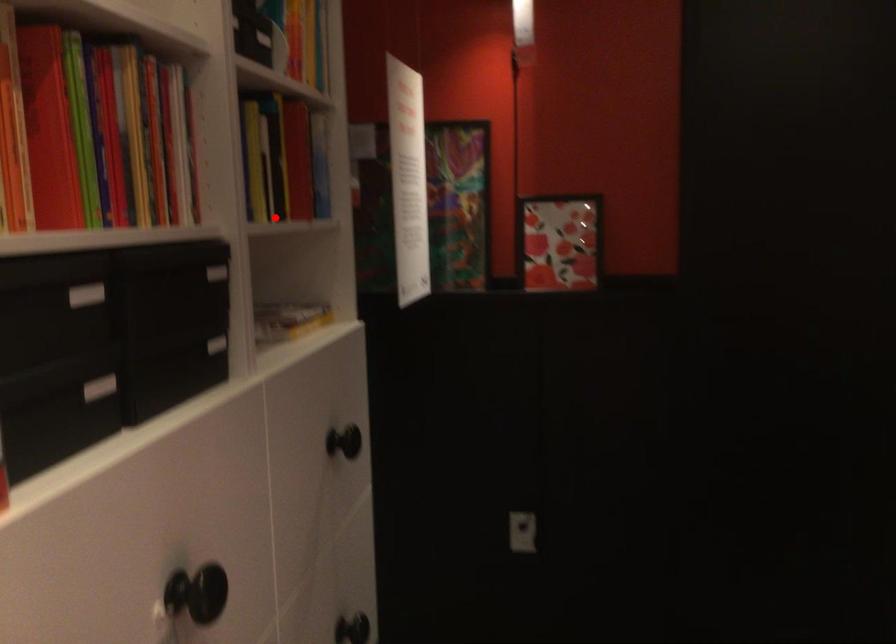
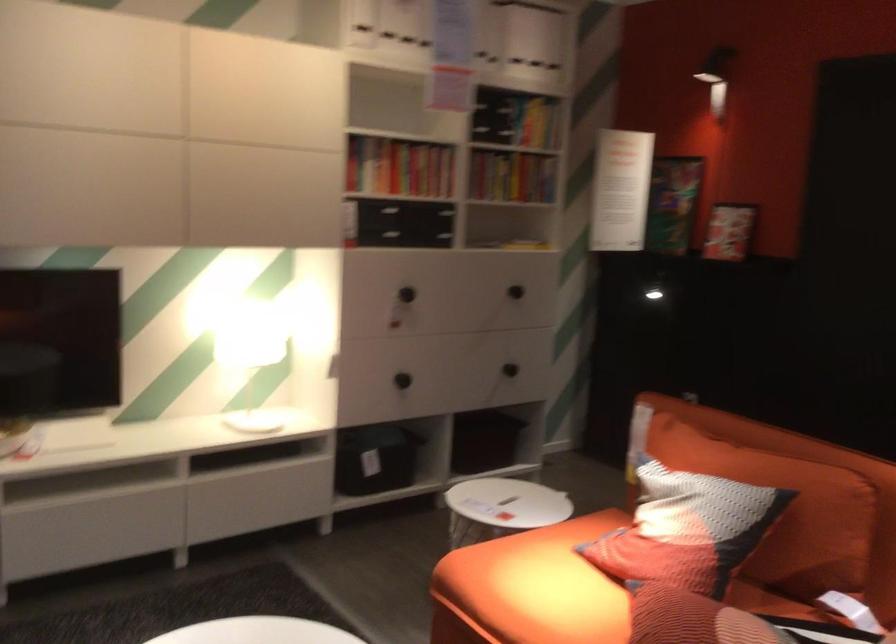
The point at the highlighted location is marked in the first image. Where is the corresponding point in the second image?

(512, 176)